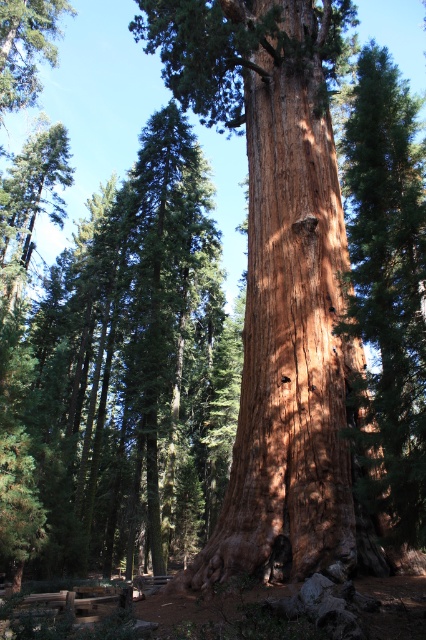
You are a park ranger assessing the forest layout. You notice the brown rough bark tree at center and the green matte tree at upper left. Which tree has a wider trunk? Please base your answer on their visual appearance in the image.

The green matte tree at upper left has a wider trunk than the brown rough bark tree at center.

You are standing in front of a towering Sequoia tree. There is a point at coordinates (276,275) in the image. Based on the scene description, what does this point most likely represent?

The point at coordinates (276,275) most likely represents the smooth reddish brown trunk at center, as indicated by the object description.